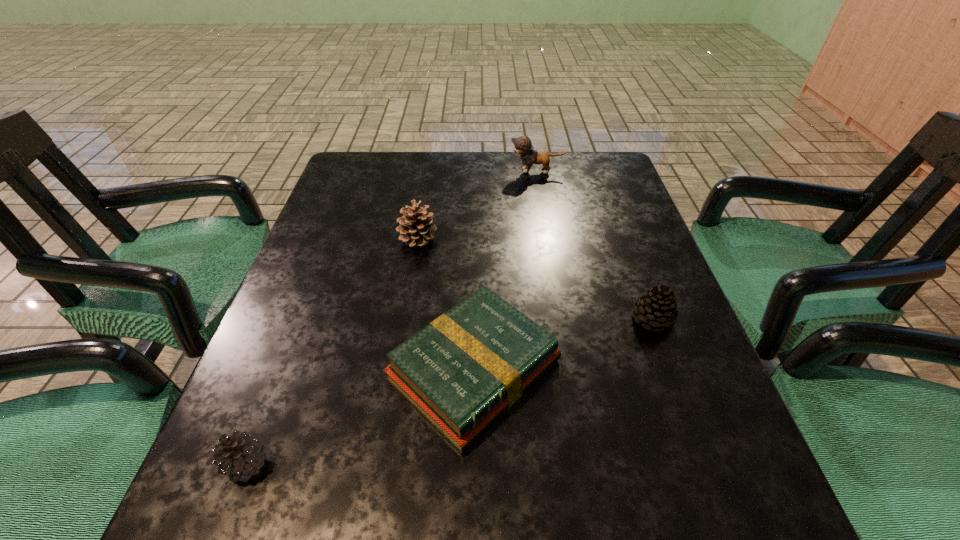
Choose which pinecone is the second nearest neighbor to the fourth nearest object. Please provide its 2D coordinates. Your answer should be formatted as a tuple, i.e. [(x, y)], where the tuple contains the x and y coordinates of a point satisfying the conditions above.

[(242, 456)]